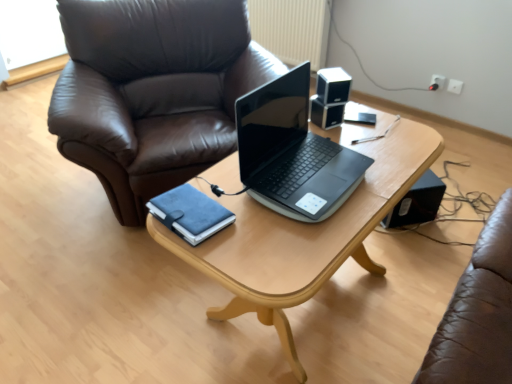
Identify the location of unoccupied area in front of black plastic speaker at upper center, arranged as the 2th speaker when viewed from the top. (346, 137).